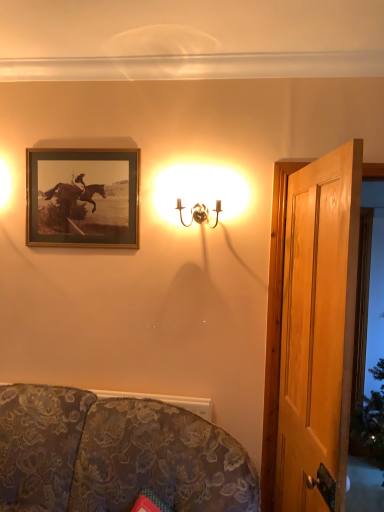
Question: Is gold-framed print at upper left situated inside floral fabric couch at lower left or outside?

Choices:
 (A) outside
 (B) inside

Answer: (A)

Question: From the image's perspective, relative to floral fabric couch at lower left, is gold-framed print at upper left above or below?

Choices:
 (A) below
 (B) above

Answer: (B)

Question: Considering the real-world distances, which object is closest to the transparent glass door at right?

Choices:
 (A) floral fabric couch at lower left
 (B) wooden door at right
 (C) gold metallic wall sconce at upper center
 (D) gold-framed print at upper left

Answer: (B)

Question: Which is nearer to the gold-framed print at upper left?

Choices:
 (A) wooden door at right
 (B) gold metallic wall sconce at upper center
 (C) transparent glass door at right
 (D) floral fabric couch at lower left

Answer: (B)